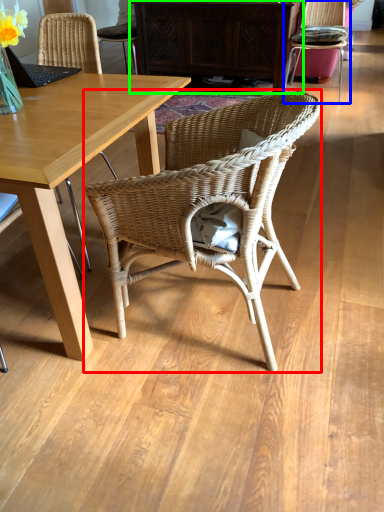
Question: Which object is the farthest from chair (highlighted by a red box)? Choose among these: chair (highlighted by a blue box) or cabinetry (highlighted by a green box).

Choices:
 (A) chair
 (B) cabinetry

Answer: (A)